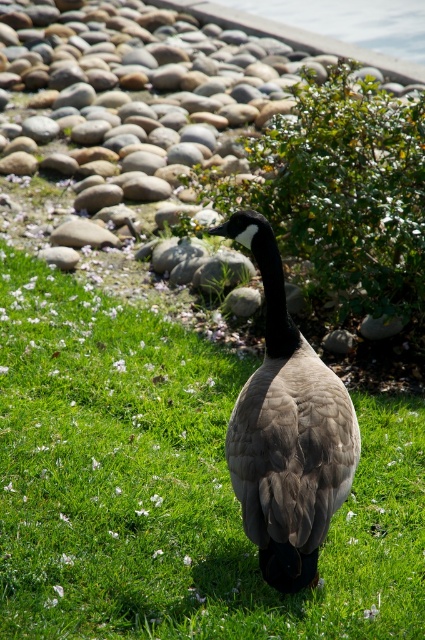
Is point (192, 627) farther from camera compared to point (309, 465)?

Yes, it is behind point (309, 465).

Is green grass at center below gray downy goose at center?

Yes.

In the scene shown: Who is more forward, (x=340, y=520) or (x=286, y=387)?

Point (x=286, y=387)

Identify the location of green grass at center. (170, 486).